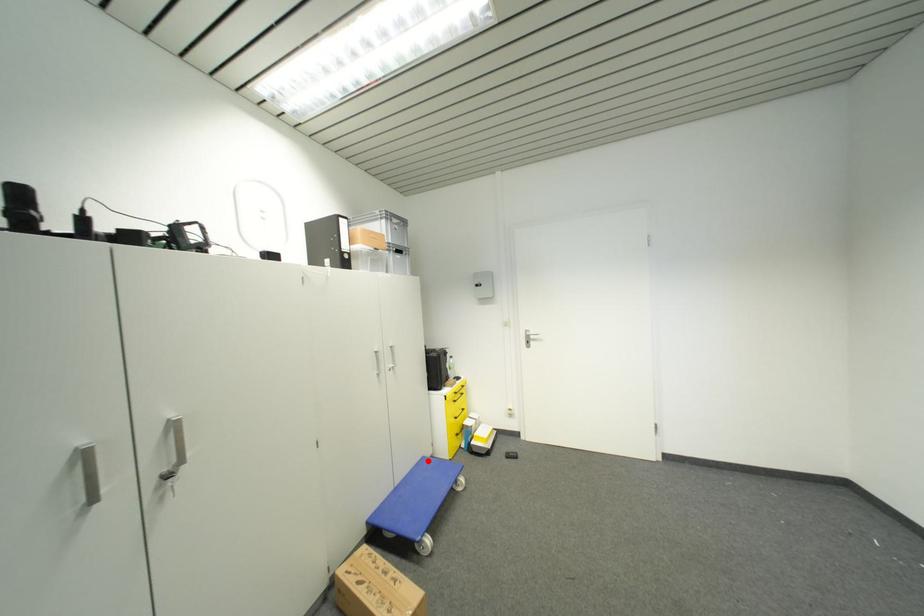
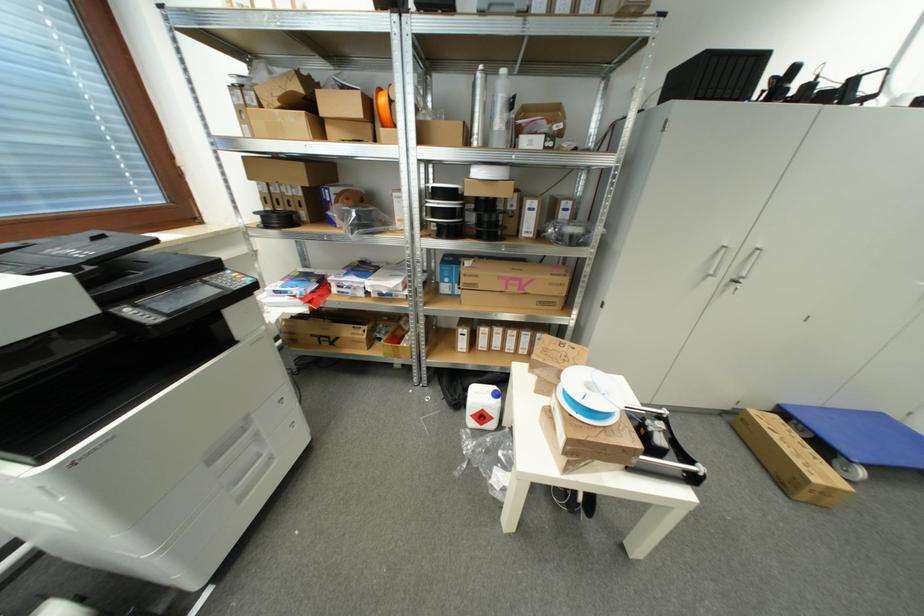
Question: I am providing you with two images of the same scene from different viewpoints. Given a red point in image1, look at the same physical point in image2. Is it:

Choices:
 (A) Closer to the viewpoint
 (B) Farther from the viewpoint

Answer: (B)